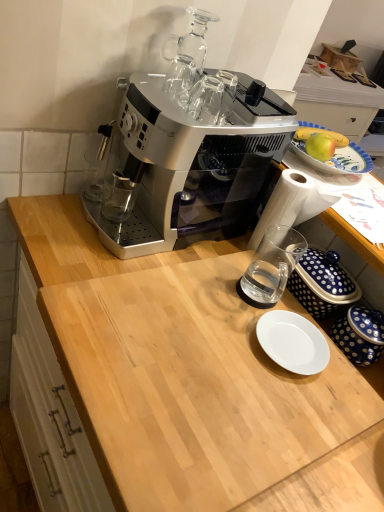
Where is `empty space that is in between white glossy plate at center and blue dotted ceramic jar at lower right`? This screenshot has width=384, height=512. empty space that is in between white glossy plate at center and blue dotted ceramic jar at lower right is located at coordinates (329, 347).